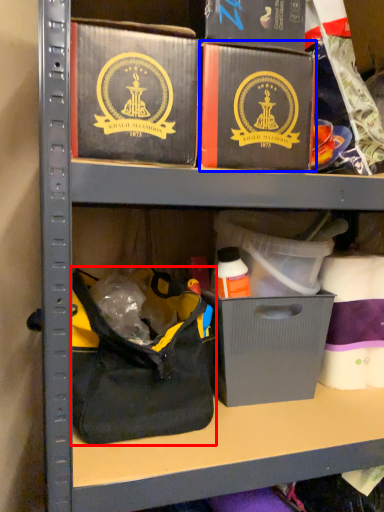
Question: Which point is further to the camera, handbag (highlighted by a red box) or box (highlighted by a blue box)?

Choices:
 (A) handbag
 (B) box

Answer: (A)